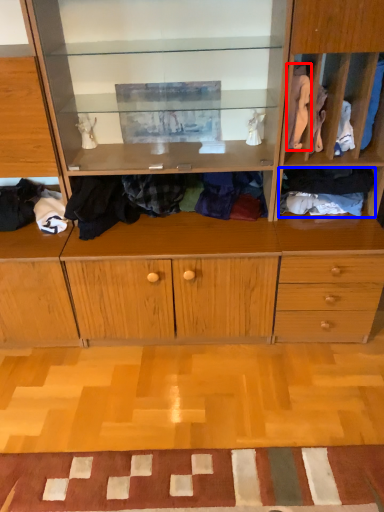
Question: Which point is closer to the camera, clothing (highlighted by a red box) or clothing (highlighted by a blue box)?

Choices:
 (A) clothing
 (B) clothing

Answer: (A)